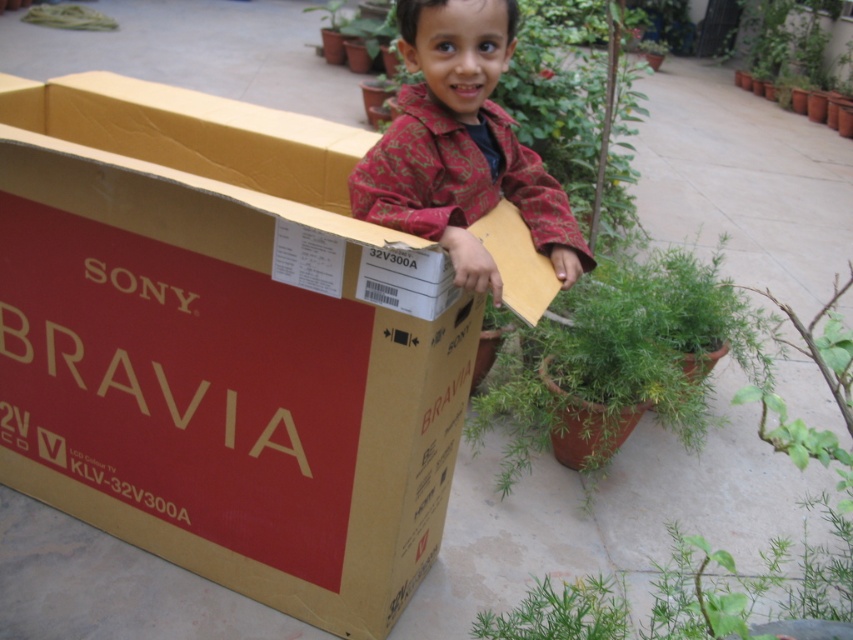
Find the location of a particular element. The image size is (853, 640). green matte plant at center is located at coordinates pos(618,356).

Does green matte plant at center have a smaller size compared to green leafy plant at lower center?

No.

Where is `green matte plant at center`? green matte plant at center is located at coordinates (618, 356).

Between red paisley shirt at center and green leafy plant at lower center, which one has more height?

Standing taller between the two is red paisley shirt at center.

Is red paisley shirt at center below green leafy plant at lower center?

No, red paisley shirt at center is not below green leafy plant at lower center.

The width and height of the screenshot is (853, 640). Describe the element at coordinates (461, 147) in the screenshot. I see `red paisley shirt at center` at that location.

Find the location of a particular element. This screenshot has height=640, width=853. red paisley shirt at center is located at coordinates (461, 147).

Can you confirm if cardboard box at center is positioned above green matte plant at center?

Incorrect, cardboard box at center is not positioned above green matte plant at center.

Who is positioned more to the right, cardboard box at center or green matte plant at center?

green matte plant at center is more to the right.

Identify the location of cardboard box at center. [x=216, y=353].